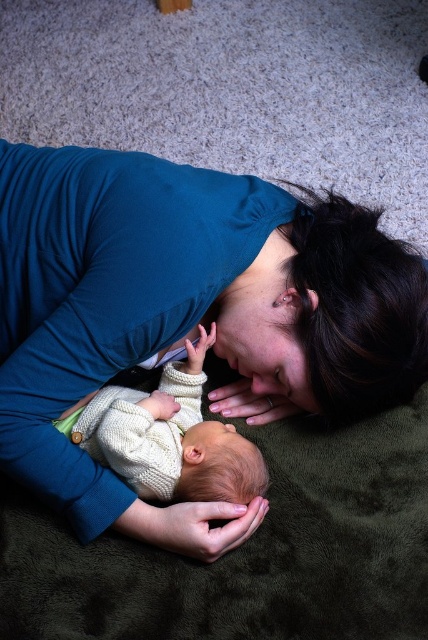
Does point (223, 310) lie behind point (238, 468)?

Yes, point (223, 310) is farther from viewer.

Measure the distance between blue fabric at center and camera.

blue fabric at center and camera are 82.74 centimeters apart.

This screenshot has width=428, height=640. Identify the location of blue fabric at center. (187, 314).

Locate an element on the screen. blue fabric at center is located at coordinates (187, 314).